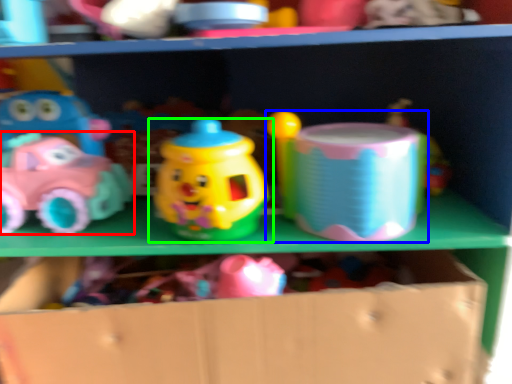
Question: Based on their relative distances, which object is farther from toy (highlighted by a red box)? Choose from toy (highlighted by a blue box) and toy (highlighted by a green box).

Choices:
 (A) toy
 (B) toy

Answer: (A)